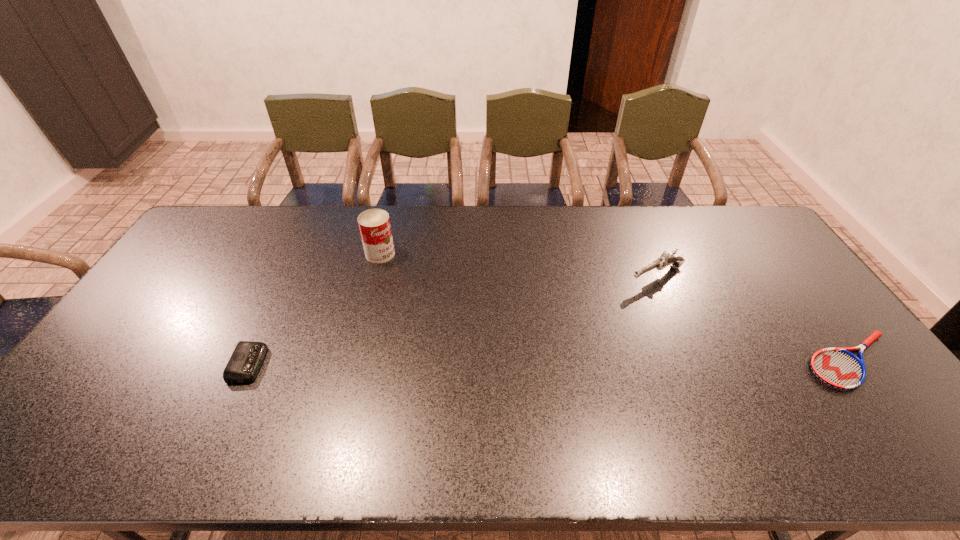
Where is `alarm clock`? The image size is (960, 540). alarm clock is located at coordinates (247, 357).

Identify the location of the third tallest object. The height and width of the screenshot is (540, 960). (247, 357).

The width and height of the screenshot is (960, 540). Identify the location of the shortest object. (838, 368).

Where is `the rightmost object`? the rightmost object is located at coordinates (838, 368).

Where is `the tallest object`? This screenshot has width=960, height=540. the tallest object is located at coordinates [x=374, y=224].

The width and height of the screenshot is (960, 540). What are the coordinates of `the third object from right to left` in the screenshot? It's located at (374, 224).

Identify the location of the third shortest object. This screenshot has width=960, height=540. (666, 259).

Locate an element on the screen. This screenshot has width=960, height=540. gun is located at coordinates (666, 259).

Find the location of a particular element. The width and height of the screenshot is (960, 540). free spot located on the display of the third tallest object is located at coordinates (289, 364).

Find the location of a particular element. The width and height of the screenshot is (960, 540). free space located 0.110m on the left of the shortest object is located at coordinates (762, 361).